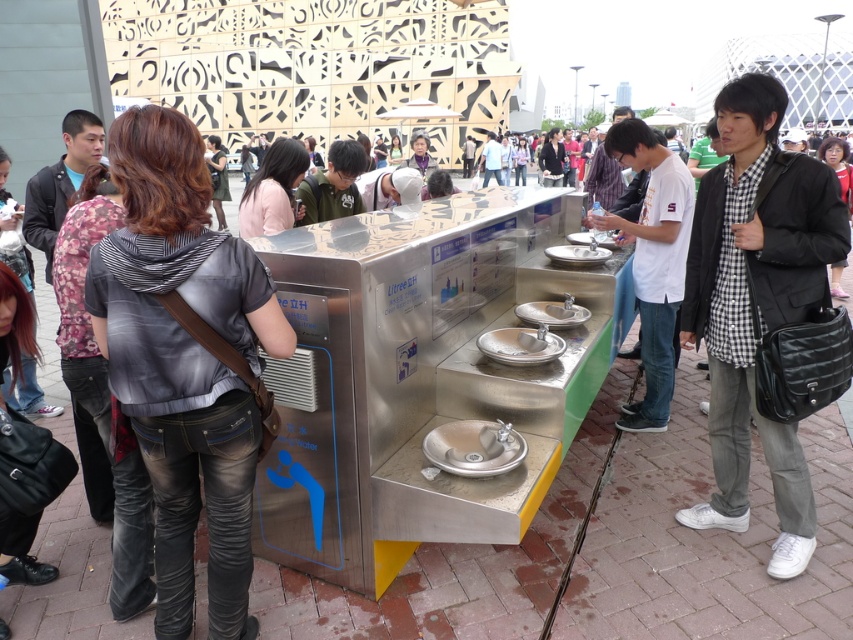
Between point (228, 506) and point (514, 340), which one is positioned behind?

Positioned behind is point (514, 340).

Find the location of `denim jacket at center`. denim jacket at center is located at coordinates (184, 362).

Can you confirm if stainless steel water fountain at center is positioned to the left of satin silver sink at center?

Indeed, stainless steel water fountain at center is positioned on the left side of satin silver sink at center.

Between stainless steel water fountain at center and satin silver sink at center, which one has more height?

stainless steel water fountain at center is taller.

What are the coordinates of `stainless steel water fountain at center` in the screenshot? It's located at (415, 378).

Between point (357, 337) and point (785, 316), which one is positioned behind?

Point (785, 316)

I want to click on stainless steel water fountain at center, so click(415, 378).

Which is behind, point (321, 276) or point (735, 193)?

Point (735, 193)

Find the location of a particular element. This screenshot has height=640, width=853. stainless steel water fountain at center is located at coordinates (x=415, y=378).